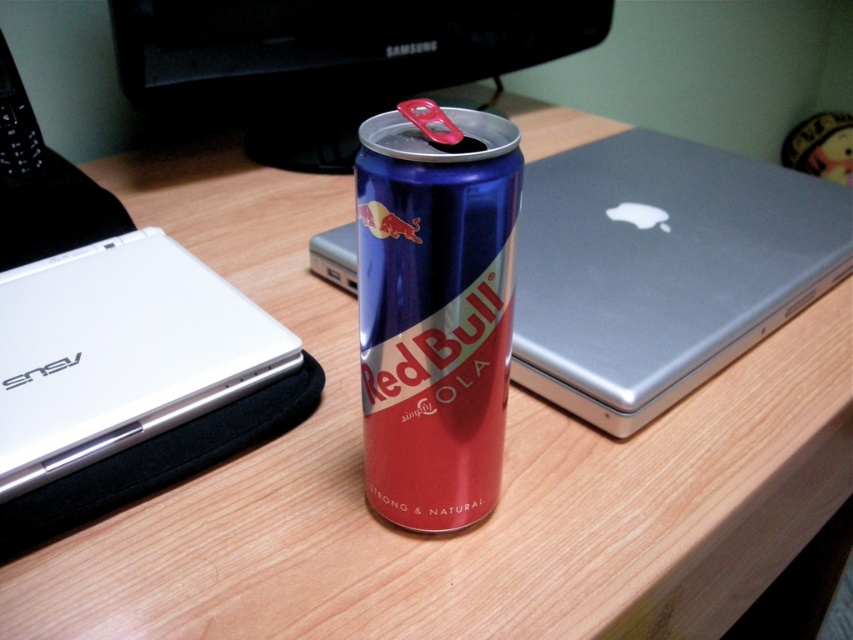
Measure the distance between point (494, 480) and camera.

Point (494, 480) is 21.50 inches from camera.

From the picture: Does metallic blue can at center appear on the right side of white matte laptop at left?

Yes, metallic blue can at center is to the right of white matte laptop at left.

Does point (456, 324) lie in front of point (120, 358)?

Yes, point (456, 324) is in front of point (120, 358).

I want to click on metallic blue can at center, so click(434, 310).

Where is `metallic silver laptop at center`? The image size is (853, 640). metallic silver laptop at center is located at coordinates (331, 60).

Which is above, sleek silver laptop at center or white matte laptop at left?

sleek silver laptop at center is higher up.

Is sleek silver laptop at center taller than white matte laptop at left?

Yes, sleek silver laptop at center is taller than white matte laptop at left.

Which is behind, point (689, 186) or point (49, 456)?

Positioned behind is point (689, 186).

The height and width of the screenshot is (640, 853). Find the location of `sleek silver laptop at center`. sleek silver laptop at center is located at coordinates (660, 268).